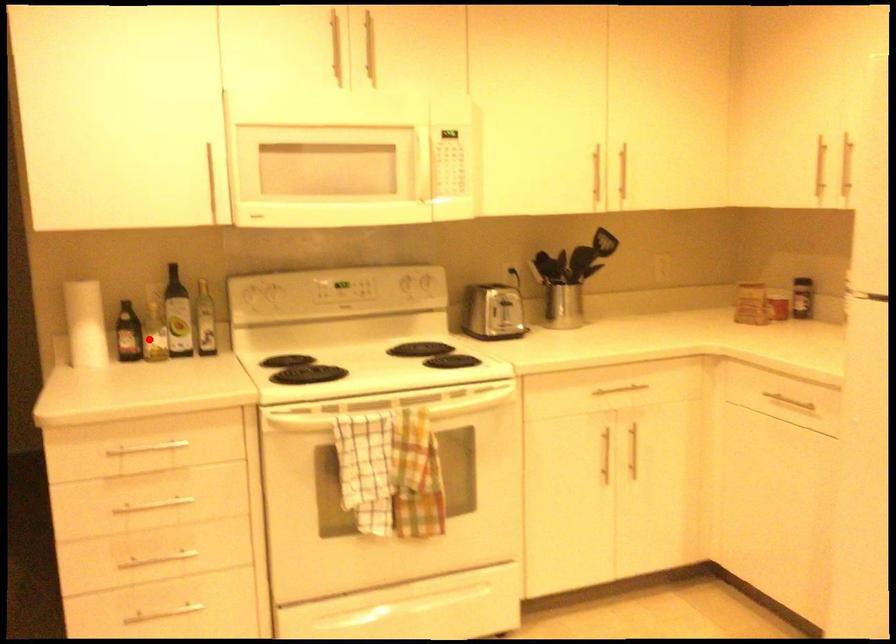
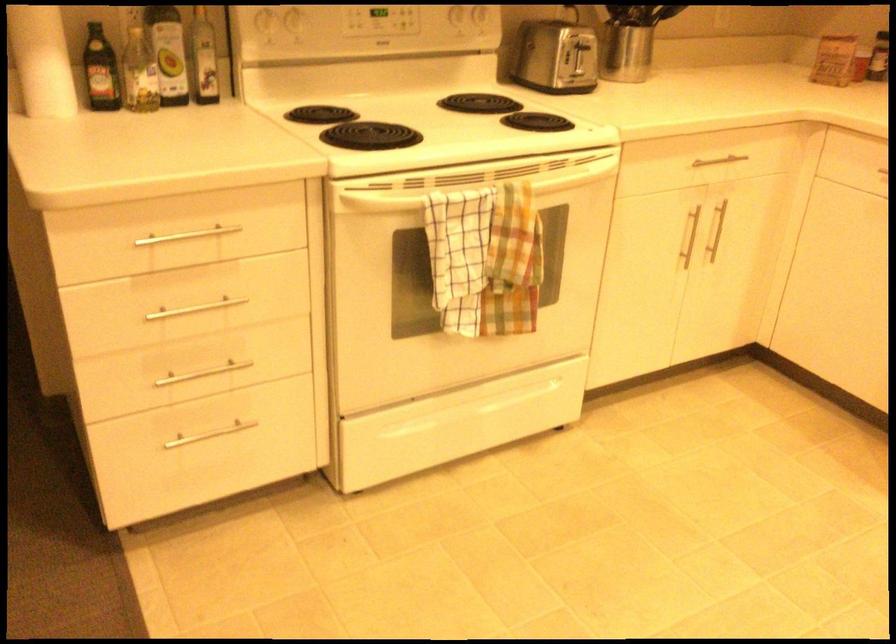
Locate, in the second image, the point that corresponds to the highlighted location in the first image.

(140, 73)